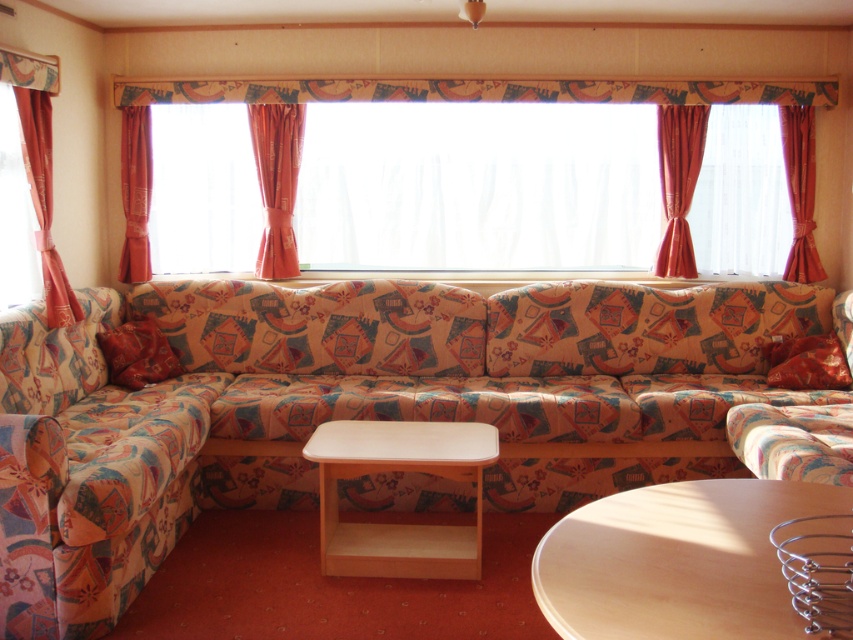
You are a delivery person who needs to place a 5 feet wide package between the coral fabric curtain at center and the transparent glass window at left. Can the package fit in the space between them?

The coral fabric curtain at center is 4.02 feet away from the transparent glass window at left. Since the package is 5 feet wide, which is wider than the available space of 4.02 feet, the package cannot fit between them.

You are standing in the caravan and want to let more natural light into the room. Which object, the transparent glass window at left or the orange fabric curtain at left, should you adjust to achieve this?

The transparent glass window at left is to the left of orange fabric curtain at left. To let more natural light in, you should adjust the orange fabric curtain at left since it is positioned over the window and can be opened further.